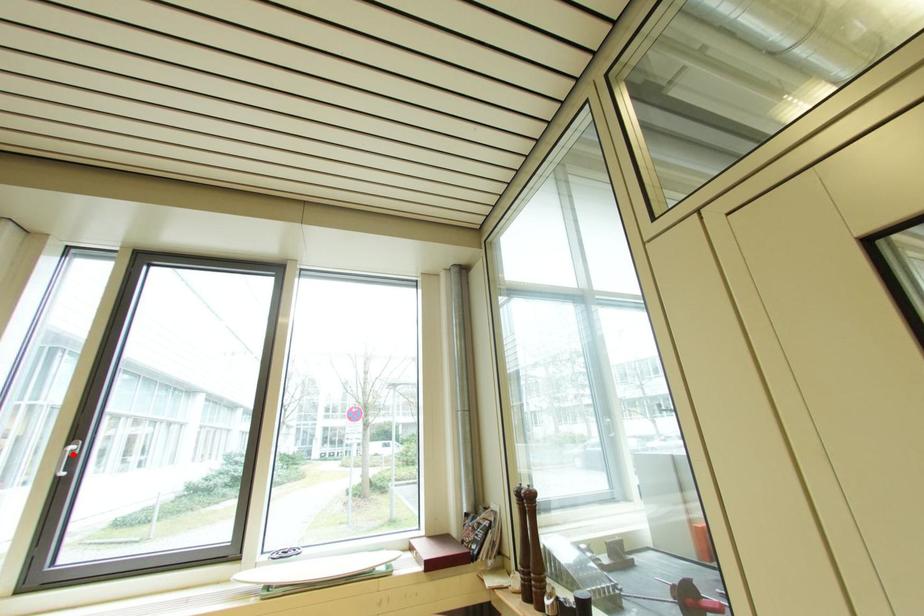
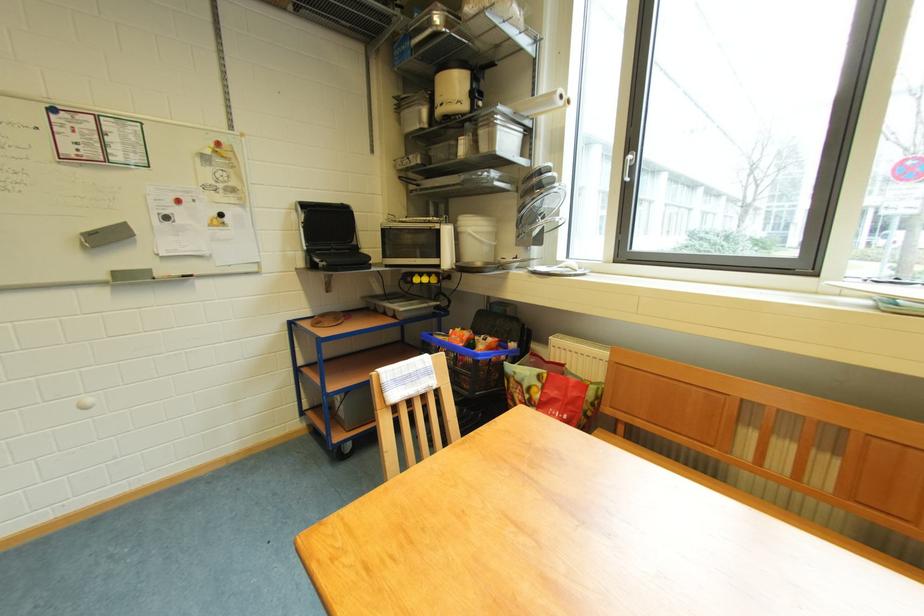
Find the pixel in the second image that matches the highlighted location in the first image.

(634, 161)